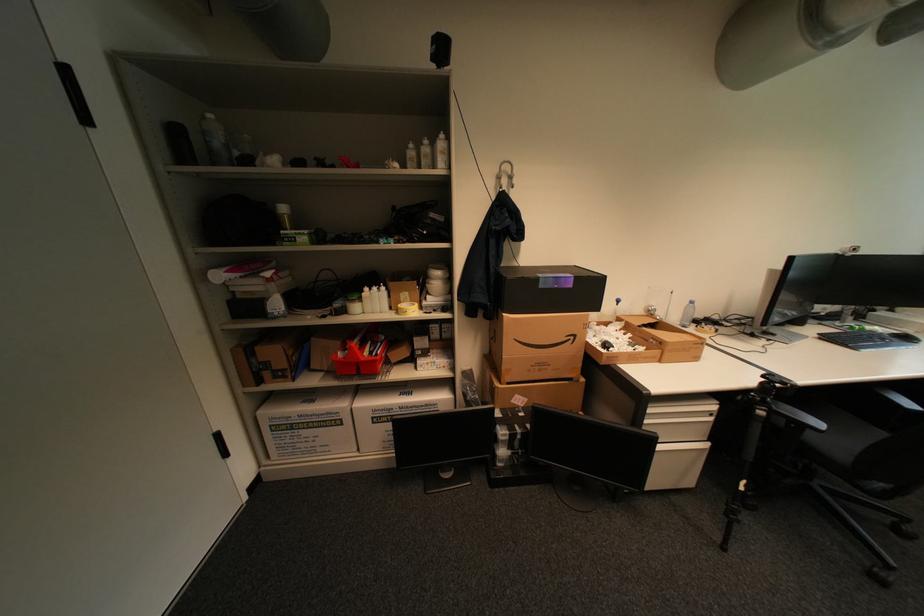
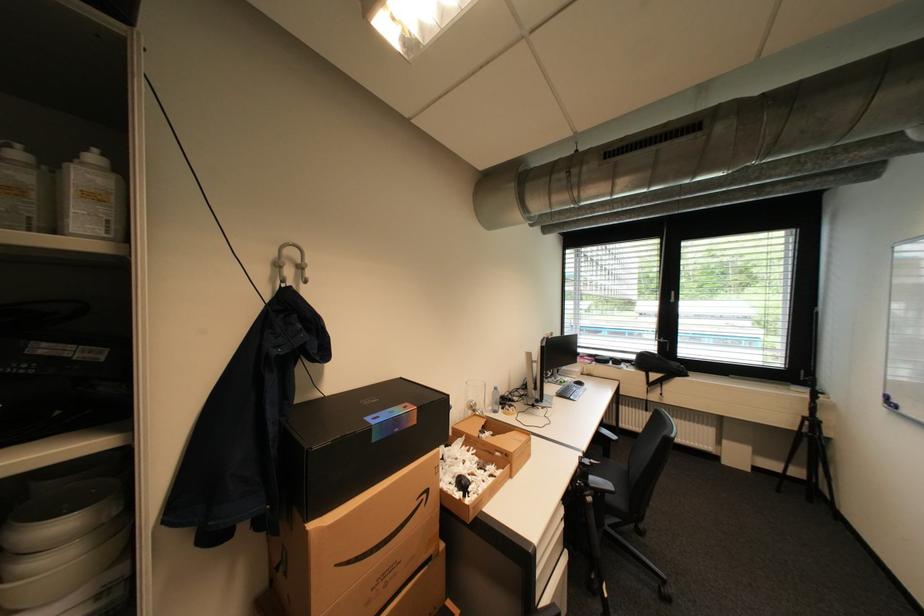
In the second image, find the point that corresponds to point (516, 215) in the first image.

(309, 326)